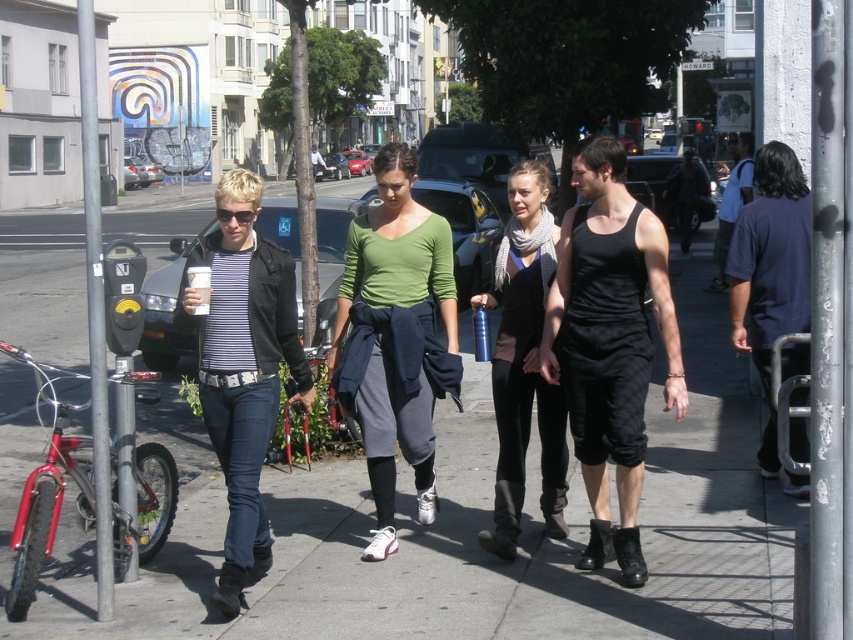
Question: Does green matte shirt at center appear under striped fabric shirt at left?

Choices:
 (A) yes
 (B) no

Answer: (B)

Question: Which is nearer to the dark blue shirt at right?

Choices:
 (A) black cotton tank top at center
 (B) matte black vest at center
 (C) green matte shirt at center

Answer: (A)

Question: Is black cotton tank top at center behind green matte shirt at center?

Choices:
 (A) yes
 (B) no

Answer: (B)

Question: Which is nearer to the green matte shirt at center?

Choices:
 (A) gray concrete sidewalk at center
 (B) striped fabric shirt at left
 (C) black cotton tank top at center
 (D) dark blue shirt at right

Answer: (B)

Question: Is gray concrete sidewalk at center closer to the viewer compared to matte black vest at center?

Choices:
 (A) yes
 (B) no

Answer: (A)

Question: Among these objects, which one is nearest to the camera?

Choices:
 (A) gray concrete sidewalk at center
 (B) striped fabric shirt at left
 (C) black tank top at center
 (D) black cotton tank top at center

Answer: (A)